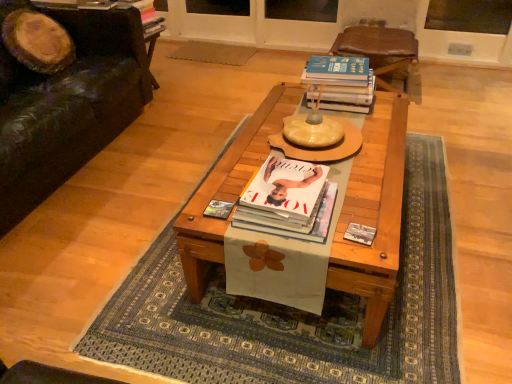
Where is `free spot to the right of white glossy book at center, acting as the 2th book starting from the top`? free spot to the right of white glossy book at center, acting as the 2th book starting from the top is located at coordinates (364, 203).